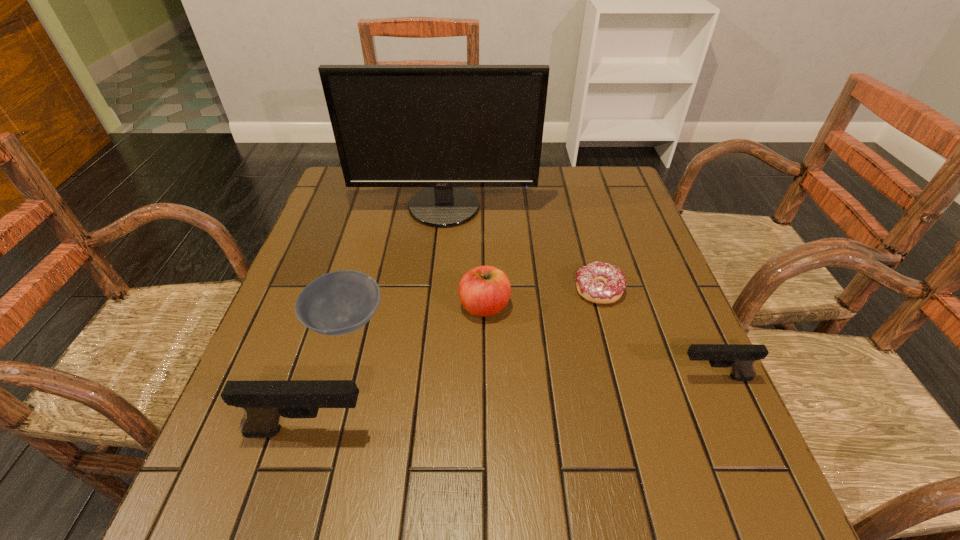
Where is `vacant region located on the front-facing side of the left pistol`? vacant region located on the front-facing side of the left pistol is located at coordinates (486, 431).

Where is `free location located on the front-facing side of the third shortest object`? This screenshot has width=960, height=540. free location located on the front-facing side of the third shortest object is located at coordinates (468, 377).

The image size is (960, 540). Identify the location of vacant position located on the front-facing side of the third shortest object. (556, 377).

Locate an element on the screen. Image resolution: width=960 pixels, height=540 pixels. vacant position located 0.330m on the front-facing side of the third shortest object is located at coordinates (505, 377).

Find the location of a particular element. free space located 0.160m on the screen side of the farthest object is located at coordinates 438,269.

Locate an element on the screen. blank area located 0.400m on the right of the fifth tallest object is located at coordinates (569, 321).

At what (x,y) coordinates should I click in order to perform the action: click on vacant position located 0.400m on the left of the apple. Please return your answer as a coordinate pair (x, y). The height and width of the screenshot is (540, 960). Looking at the image, I should click on (280, 306).

Find the location of a particular element. Image resolution: width=960 pixels, height=540 pixels. vacant space located on the right of the shortest object is located at coordinates (662, 290).

Locate an element on the screen. object positioned at the far edge is located at coordinates (445, 127).

The image size is (960, 540). Find the location of `object located at the near edge`. object located at the near edge is located at coordinates (264, 402).